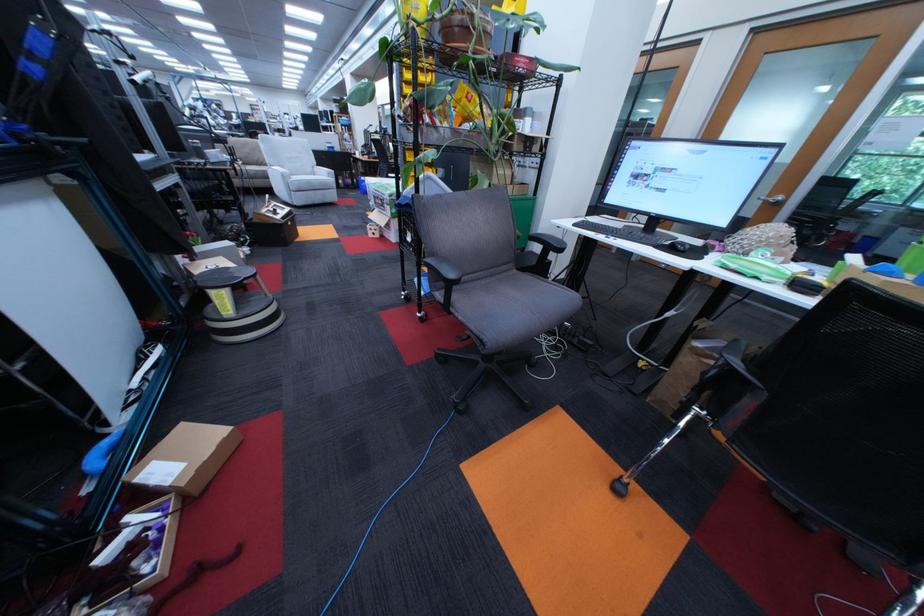
Locate an element on the screen. metal door handle is located at coordinates (772, 199).